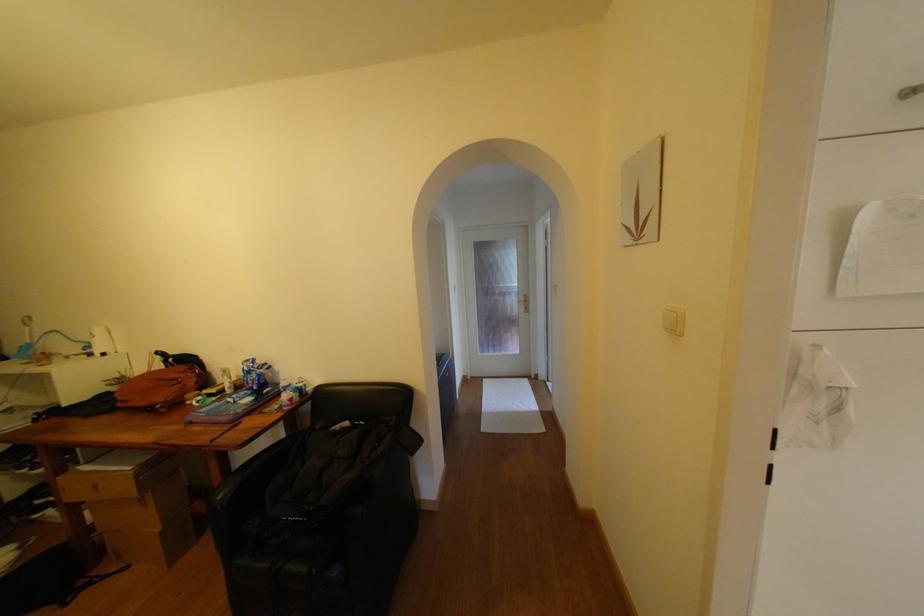
Where is `gold door handle`? gold door handle is located at coordinates [x=524, y=301].